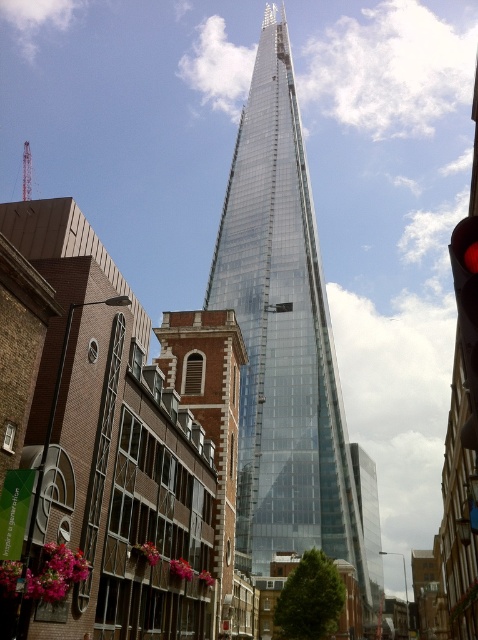
Is the position of transparent glass tower at center less distant than that of red glass traffic light at right?

No, transparent glass tower at center is further to the viewer.

Who is shorter, transparent glass tower at center or red glass traffic light at right?

red glass traffic light at right

Is point (282, 257) less distant than point (456, 250)?

That is False.

Where is `transparent glass tower at center`? Image resolution: width=478 pixels, height=640 pixels. transparent glass tower at center is located at coordinates (286, 344).